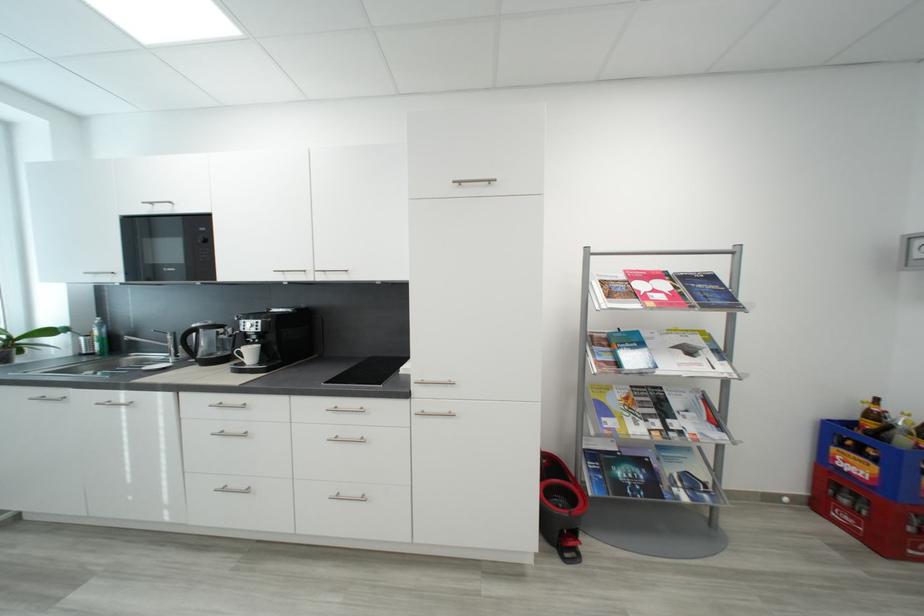
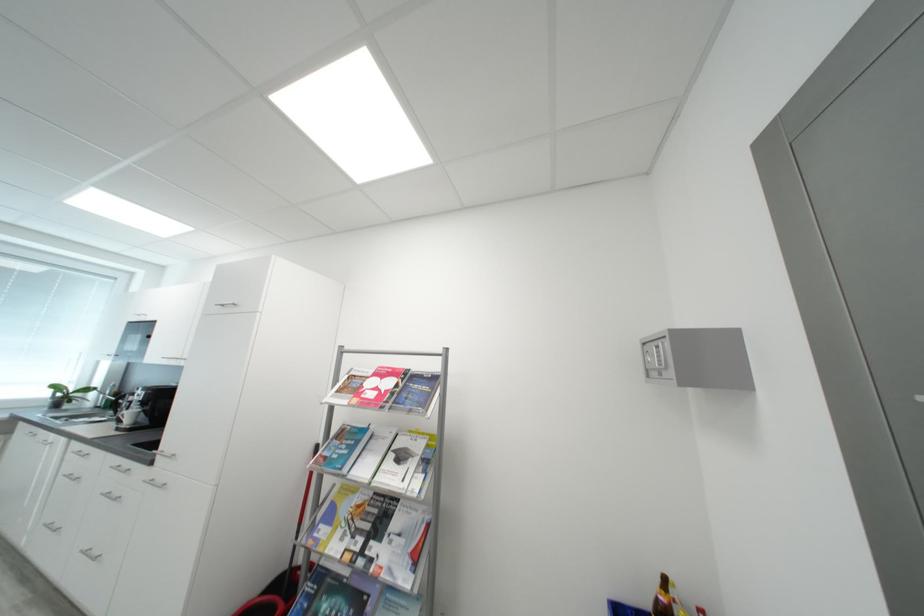
In the second image, find the point that corresponds to point 467,185 in the first image.

(228, 307)